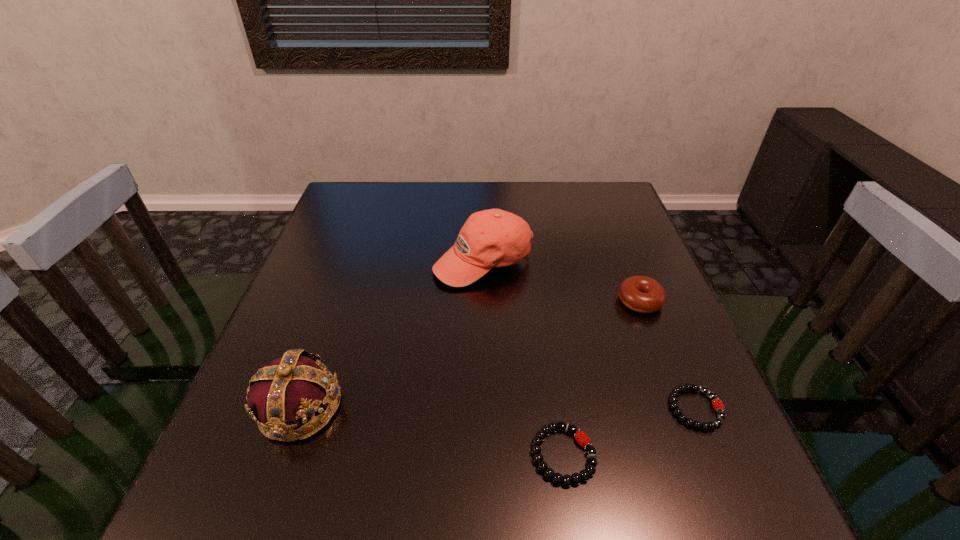
This screenshot has width=960, height=540. I want to click on object that can be found as the fourth closest to the right bracelet, so click(x=290, y=391).

The height and width of the screenshot is (540, 960). What are the coordinates of `free space that satisfies the following two spatial constraints: 1. on the front side of the third shortest object; 2. on the left side of the right bracelet` in the screenshot? It's located at (683, 409).

At what (x,y) coordinates should I click in order to perform the action: click on vacant space that satisfies the following two spatial constraints: 1. on the front side of the left bracelet; 2. on the left side of the leftmost object. Please return your answer as a coordinate pair (x, y). This screenshot has width=960, height=540. Looking at the image, I should click on (282, 455).